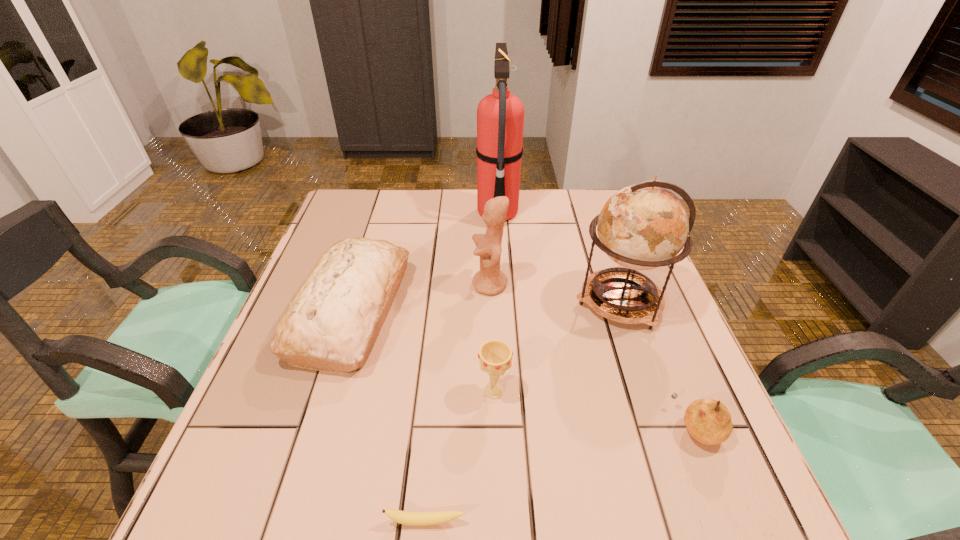
Where is `vacant space located on the left of the sixth tallest object`? vacant space located on the left of the sixth tallest object is located at coordinates (578, 428).

At what (x,y) coordinates should I click in order to perform the action: click on object that is at the far edge. Please return your answer as a coordinate pair (x, y). This screenshot has height=540, width=960. Looking at the image, I should click on (500, 116).

This screenshot has height=540, width=960. Identify the location of object present at the near edge. (407, 518).

The width and height of the screenshot is (960, 540). What are the coordinates of `object situated at the left edge` in the screenshot? It's located at (332, 323).

At what (x,y) coordinates should I click in order to perform the action: click on globe that is at the right edge. Please return your answer as a coordinate pair (x, y). The image size is (960, 540). Looking at the image, I should click on (644, 226).

Image resolution: width=960 pixels, height=540 pixels. I want to click on pear present at the right edge, so click(x=708, y=421).

In the image, there is a desktop. Where is `vacant area at the far edge`? The width and height of the screenshot is (960, 540). vacant area at the far edge is located at coordinates (520, 219).

Where is `vacant space at the near edge of the desktop`? vacant space at the near edge of the desktop is located at coordinates (426, 498).

Where is `vacant point at the right edge`? Image resolution: width=960 pixels, height=540 pixels. vacant point at the right edge is located at coordinates (687, 371).

Identify the location of vacant space at the far left corner of the desktop. This screenshot has width=960, height=540. (383, 196).